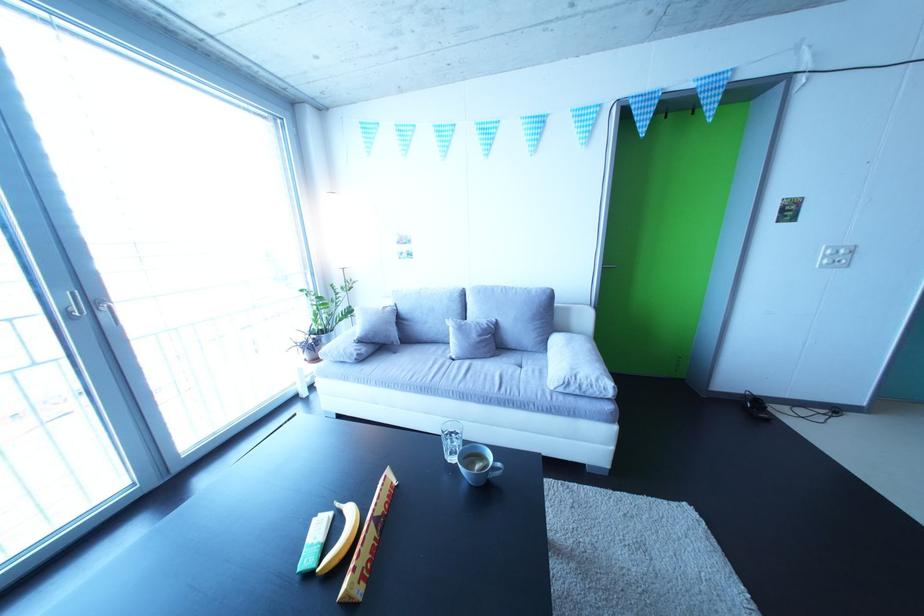
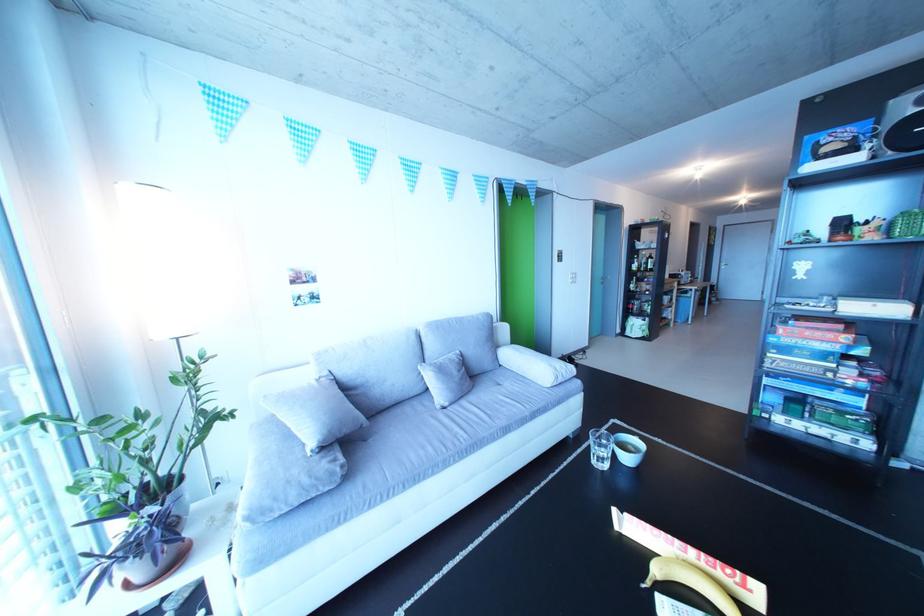
The point at (391, 346) is marked in the first image. Where is the corresponding point in the second image?

(359, 437)